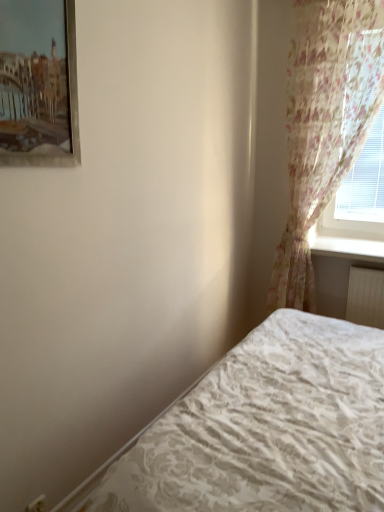
Question: From the image's perspective, relative to white textured bed at lower right, is metallic silver picture frame at upper left above or below?

Choices:
 (A) above
 (B) below

Answer: (A)

Question: From a real-world perspective, is metallic silver picture frame at upper left physically located above or below white textured bed at lower right?

Choices:
 (A) below
 (B) above

Answer: (B)

Question: Estimate the real-world distances between objects in this image. Which object is closer to the metallic silver picture frame at upper left?

Choices:
 (A) white textured bed at lower right
 (B) floral sheer curtain at right
 (C) white glossy window sill at upper right

Answer: (A)

Question: Considering the real-world distances, which object is closest to the white glossy window sill at upper right?

Choices:
 (A) white textured bed at lower right
 (B) floral sheer curtain at right
 (C) metallic silver picture frame at upper left

Answer: (B)